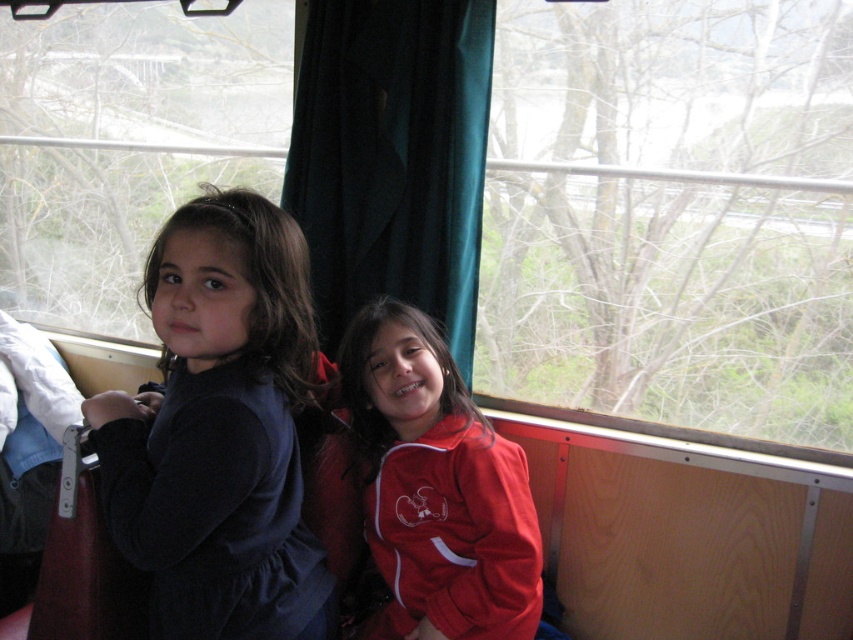
Which is in front, point (548, 138) or point (370, 332)?

Point (370, 332) is in front.

Is transparent glass window at center above red matte jacket at center?

Correct, transparent glass window at center is located above red matte jacket at center.

Is point (511, 371) positioned after point (364, 362)?

Yes, it is behind point (364, 362).

Find the location of a particular element. This screenshot has height=640, width=853. transparent glass window at center is located at coordinates (672, 214).

Can you confirm if velvet dark blue dress at left is wider than transparent glass window at upper left?

No.

Does point (248, 429) lie behind point (144, 161)?

No, it is in front of (144, 161).

Is point (289, 508) positioned after point (248, 145)?

No, (289, 508) is in front of (248, 145).

Find the location of a particular element. This screenshot has height=640, width=853. velvet dark blue dress at left is located at coordinates (219, 429).

Can you confirm if velvet dark blue dress at left is bigger than red matte jacket at center?

Yes.

Can you confirm if velvet dark blue dress at left is positioned to the left of red matte jacket at center?

Yes, velvet dark blue dress at left is to the left of red matte jacket at center.

Which is in front, point (109, 449) or point (451, 362)?

Positioned in front is point (109, 449).

The image size is (853, 640). What are the coordinates of `velvet dark blue dress at left` in the screenshot? It's located at click(219, 429).